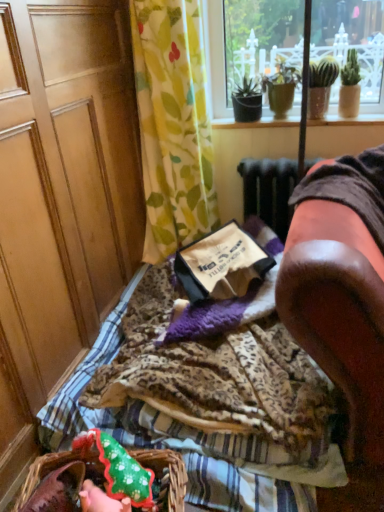
Find the location of `brown paper bag at center`. brown paper bag at center is located at coordinates (221, 264).

Describe the element at coordinates (218, 383) in the screenshot. Image resolution: width=384 pixels, height=512 pixels. I see `leopard print fabric at center` at that location.

This screenshot has width=384, height=512. Describe the element at coordinates (169, 471) in the screenshot. I see `green fabric flower basket at lower left` at that location.

Locate an element on the screen. Image resolution: width=384 pixels, height=512 pixels. green floral fabric at upper center is located at coordinates (173, 124).

From a real-world perspective, is brown paper bag at center physically located above or below green fabric flower basket at lower left?

From a real-world perspective, brown paper bag at center is physically above green fabric flower basket at lower left.

Which is nearer, (257,247) or (178,486)?

Point (257,247) is farther from the camera than point (178,486).

Which is more to the left, brown paper bag at center or green fabric flower basket at lower left?

green fabric flower basket at lower left is more to the left.

What's the angular difference between brown paper bag at center and brown leather armchair at right's facing directions?

42.7 degrees.

Is brown paper bag at center spatially inside brown leather armchair at right, or outside of it?

The correct answer is: outside.

Considering the positions of point (263, 275) and point (363, 500), is point (263, 275) closer or farther from the camera than point (363, 500)?

Point (263, 275).

From the picture: Who is shorter, brown paper bag at center or brown leather armchair at right?

With less height is brown paper bag at center.

Is wooden screen door at left next to brown leather armchair at right and touching it?

No, wooden screen door at left is not beside brown leather armchair at right.

Does point (28, 288) lie behind point (347, 398)?

That is True.

What's the angular difference between wooden screen door at left and brown leather armchair at right's facing directions?

There is a 89.8-degree angle between the facing directions of wooden screen door at left and brown leather armchair at right.

From the image's perspective, which object appears higher, wooden screen door at left or brown leather armchair at right?

wooden screen door at left, from the image's perspective.

Is wooden screen door at left to the left of green floral fabric at upper center from the viewer's perspective?

Correct, you'll find wooden screen door at left to the left of green floral fabric at upper center.

Consider the image. Is wooden screen door at left with green floral fabric at upper center?

No, wooden screen door at left is not beside green floral fabric at upper center.

Is wooden screen door at left closer to the viewer compared to green floral fabric at upper center?

Yes, wooden screen door at left is closer to the camera.

What's the angular difference between wooden screen door at left and green floral fabric at upper center's facing directions?

There is a 90.2-degree angle between the facing directions of wooden screen door at left and green floral fabric at upper center.

From a real-world perspective, is brown paper bag at center above or below green floral fabric at upper center?

Clearly, from a real-world perspective, brown paper bag at center is below green floral fabric at upper center.

Can you confirm if brown paper bag at center is smaller than green floral fabric at upper center?

Indeed, brown paper bag at center has a smaller size compared to green floral fabric at upper center.

How much distance is there between brown paper bag at center and green floral fabric at upper center?

brown paper bag at center and green floral fabric at upper center are 16.98 inches apart.

Is brown paper bag at center not close to green floral fabric at upper center?

Actually, brown paper bag at center and green floral fabric at upper center are a little close together.

The width and height of the screenshot is (384, 512). In the image, there is a green fabric flower basket at lower left. What are the coordinates of `screen door above it (from the image's perspective)` in the screenshot? It's located at 61,198.

Is point (157, 459) closer to camera compared to point (4, 5)?

No, it is not.

Which is more to the left, green fabric flower basket at lower left or wooden screen door at left?

wooden screen door at left.

From the image's perspective, is green fabric flower basket at lower left above or below wooden screen door at left?

green fabric flower basket at lower left is situated lower than wooden screen door at left in the image.

Does brown leather armchair at right have a greater height compared to green floral fabric at upper center?

In fact, brown leather armchair at right may be shorter than green floral fabric at upper center.

Is point (336, 499) closer or farther from the camera than point (192, 67)?

Point (336, 499).

In the image, is brown leather armchair at right positioned in front of or behind green floral fabric at upper center?

Clearly, brown leather armchair at right is in front of green floral fabric at upper center.

From a real-world perspective, who is located lower, brown leather armchair at right or green floral fabric at upper center?

From a 3D spatial view, brown leather armchair at right is below.

In the image, there is a brown paper bag at center. Identify the location of flower basket below it (from the image's perspective). (169, 471).

This screenshot has height=512, width=384. Find the location of `furniture above the brown paper bag at center (from a real-world perspective)`. furniture above the brown paper bag at center (from a real-world perspective) is located at coordinates (343, 305).

When comparing their distances from green floral fabric at upper center, does leopard print fabric at center or brown leather armchair at right seem closer?

The object closer to green floral fabric at upper center is leopard print fabric at center.

From the image, which object appears to be nearer to green fabric flower basket at lower left, green floral fabric at upper center or brown leather armchair at right?

brown leather armchair at right is closer to green fabric flower basket at lower left.

Looking at the image, which one is located further to green floral fabric at upper center, wooden screen door at left or green fabric flower basket at lower left?

green fabric flower basket at lower left is further to green floral fabric at upper center.

Looking at the image, which one is located closer to green fabric flower basket at lower left, green floral fabric at upper center or brown paper bag at center?

brown paper bag at center is positioned closer to the anchor green fabric flower basket at lower left.

When comparing their distances from green fabric flower basket at lower left, does brown paper bag at center or brown leather armchair at right seem further?

brown paper bag at center.

When comparing their distances from wooden screen door at left, does green floral fabric at upper center or brown paper bag at center seem further?

Among the two, brown paper bag at center is located further to wooden screen door at left.

Based on the photo, when comparing their distances from brown leather armchair at right, does green fabric flower basket at lower left or leopard print fabric at center seem closer?

Based on the image, leopard print fabric at center appears to be nearer to brown leather armchair at right.

Which object lies further to the anchor point leopard print fabric at center, brown paper bag at center or green fabric flower basket at lower left?

The object further to leopard print fabric at center is green fabric flower basket at lower left.

Identify the location of blanket positioned between brown leather armchair at right and brown paper bag at center from near to far. Image resolution: width=384 pixels, height=512 pixels. (218, 383).

I want to click on furniture between green floral fabric at upper center and green fabric flower basket at lower left from top to bottom, so click(x=343, y=305).

Locate an element on the screen. The width and height of the screenshot is (384, 512). paperback book situated between wooden screen door at left and brown leather armchair at right from left to right is located at coordinates (221, 264).

Locate an element on the screen. This screenshot has height=512, width=384. flower basket between wooden screen door at left and brown paper bag at center from front to back is located at coordinates (169, 471).